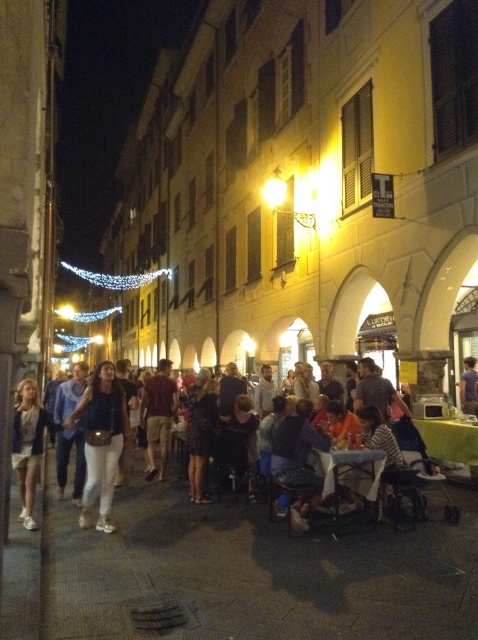
Question: Can you confirm if brown textured shorts at center is smaller than blue cotton shirt at center?

Choices:
 (A) yes
 (B) no

Answer: (A)

Question: Estimate the real-world distances between objects in this image. Which object is farther from the dark blue jeans at center?

Choices:
 (A) brown textured shorts at center
 (B) light beige denim jacket at lower left
 (C) matte black top at center

Answer: (A)

Question: Where is dark blue jeans at center located in relation to light beige denim jacket at lower left in the image?

Choices:
 (A) right
 (B) left

Answer: (A)

Question: Which point is closer to the camera?

Choices:
 (A) (464, 376)
 (B) (97, 424)
 (C) (32, 433)
 (D) (143, 419)

Answer: (B)

Question: Where is light beige denim jacket at lower left located in relation to blue cotton shirt at center in the image?

Choices:
 (A) below
 (B) above

Answer: (A)

Question: Which is nearer to the blue cotton shirt at center?

Choices:
 (A) dark blue jeans at center
 (B) light beige denim jacket at lower left
 (C) matte black top at center
 (D) brown textured shorts at center

Answer: (D)